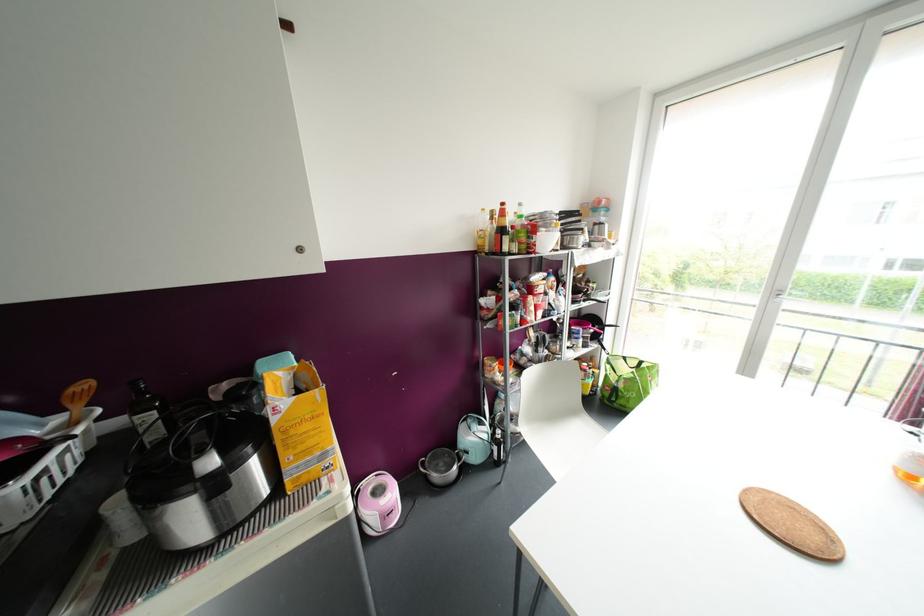
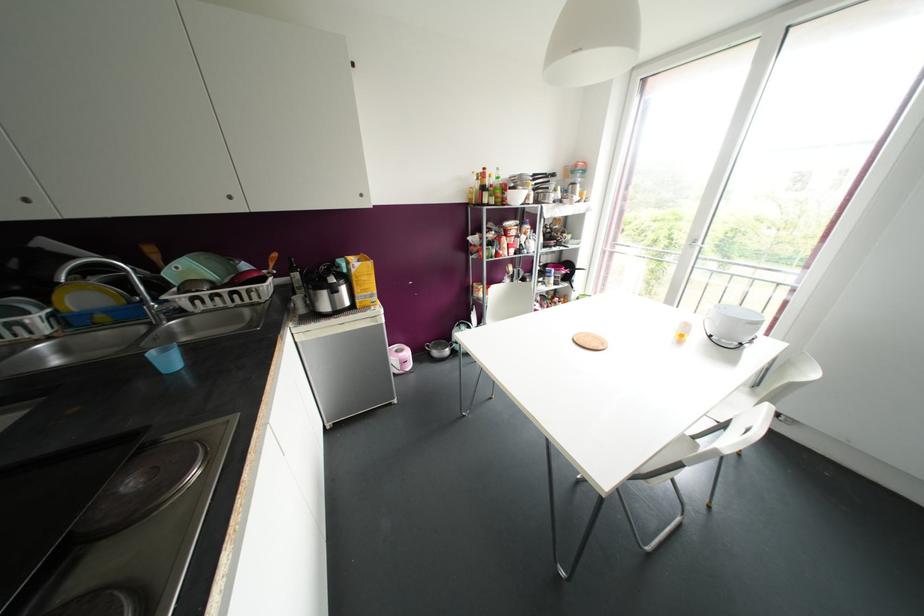
Question: I am providing you with two images of the same scene from different viewpoints. Please identify which objects are invisible in image2.

Choices:
 (A) green shopping bag
 (B) white outlet cover
 (C) brown round coaster
 (D) small blue cup

Answer: (A)